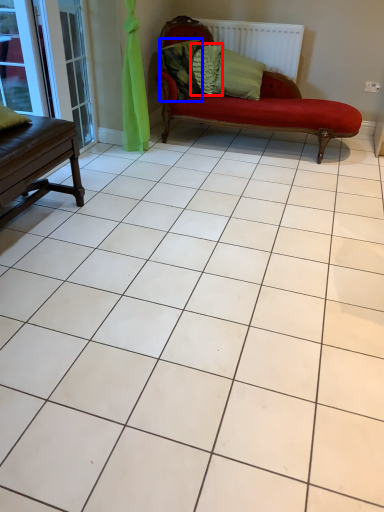
Question: Which object appears closest to the camera in this image, pillow (highlighted by a red box) or pillow (highlighted by a blue box)?

Choices:
 (A) pillow
 (B) pillow

Answer: (B)